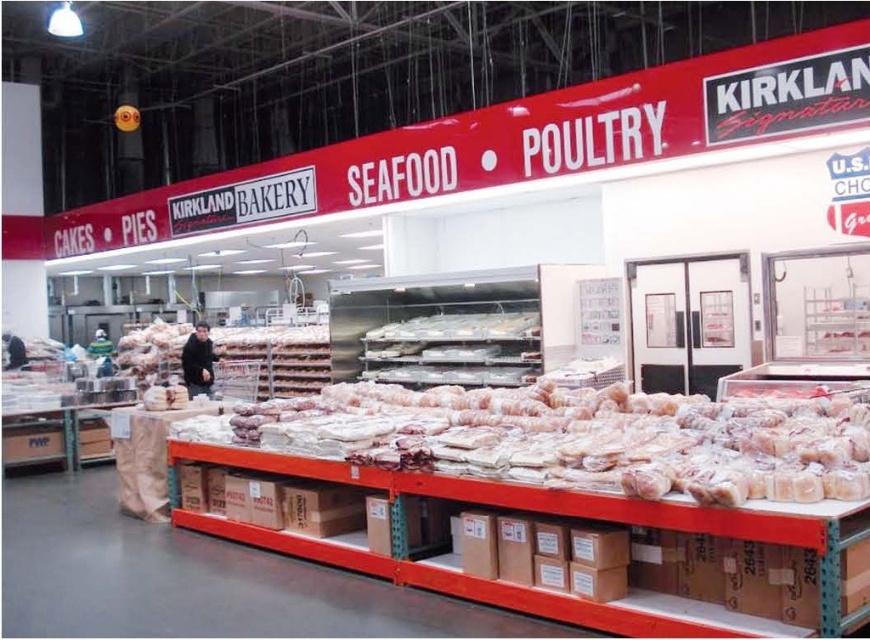
Question: Can you confirm if translucent plastic baguette at center is positioned below white plastic trays at center?

Choices:
 (A) yes
 (B) no

Answer: (A)

Question: Can you confirm if translucent plastic baguette at center is positioned above white plastic trays at center?

Choices:
 (A) yes
 (B) no

Answer: (B)

Question: Among these objects, which one is nearest to the camera?

Choices:
 (A) white plastic trays at center
 (B) translucent plastic baguette at center

Answer: (B)

Question: Can you confirm if translucent plastic baguette at center is positioned to the left of white plastic trays at center?

Choices:
 (A) yes
 (B) no

Answer: (B)